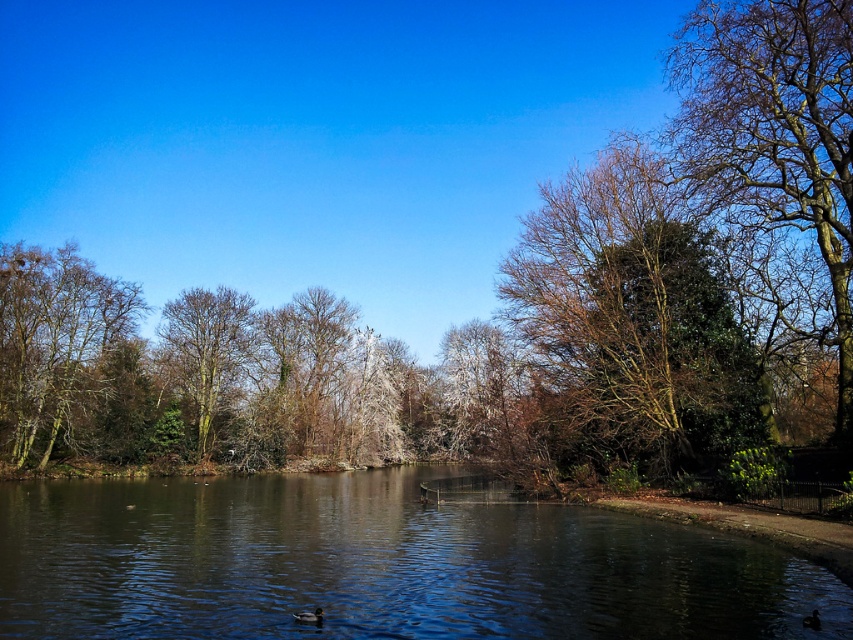
Question: Observing the image, what is the correct spatial positioning of bare branches tree at right in reference to bare branches at left?

Choices:
 (A) right
 (B) left

Answer: (A)

Question: Which object is farther from the camera taking this photo?

Choices:
 (A) bare branches tree at right
 (B) smooth bark tree at center

Answer: (B)

Question: Is bare branches at upper right wider than bare branches at left?

Choices:
 (A) no
 (B) yes

Answer: (A)

Question: Which object is farther from the camera taking this photo?

Choices:
 (A) dark brown glossy duck at lower center
 (B) bare branches at left
 (C) bare branches at upper right
 (D) bare branches tree at right

Answer: (B)

Question: Which point is closer to the camera?

Choices:
 (A) (318, 625)
 (B) (456, 413)
 (C) (682, 45)

Answer: (A)

Question: Can you confirm if smooth reflective water at center is wider than bare branches at left?

Choices:
 (A) no
 (B) yes

Answer: (B)